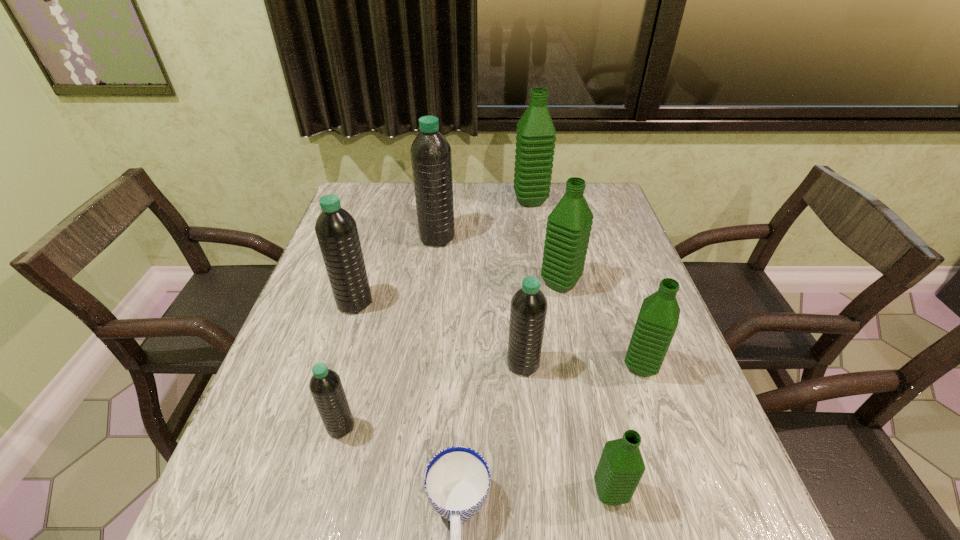
The image size is (960, 540). What are the coordinates of `blank space located on the front of the nearest black water bottle` in the screenshot? It's located at (317, 519).

Find the location of a particular element. vacant space located 0.300m on the back of the smallest green water bottle is located at coordinates (578, 346).

Locate an element on the screen. The height and width of the screenshot is (540, 960). object located at the far edge is located at coordinates [535, 138].

What are the coordinates of `object that is at the near edge` in the screenshot? It's located at (621, 466).

At what (x,y) coordinates should I click in order to perform the action: click on object present at the right edge. Please return your answer as a coordinate pair (x, y). Looking at the image, I should click on (657, 321).

At what (x,y) coordinates should I click in order to perform the action: click on blank space at the left edge. Please return your answer as a coordinate pair (x, y). Looking at the image, I should click on (371, 264).

Identify the location of free space at the right edge of the desktop. The height and width of the screenshot is (540, 960). (640, 271).

You are a GUI agent. You are given a task and a screenshot of the screen. Output one action in this format:
    pyautogui.click(x=<x>, y=<y>)
    Task: Click on the free region at the far left corner of the desktop
    
    Given the screenshot: What is the action you would take?
    pyautogui.click(x=350, y=208)

The image size is (960, 540). What are the coordinates of `vacant space at the far right corner of the desktop` in the screenshot? It's located at (609, 204).

Identify the location of vacant area that lies between the second biggest black water bottle and the nearest black water bottle. This screenshot has width=960, height=540. (348, 364).